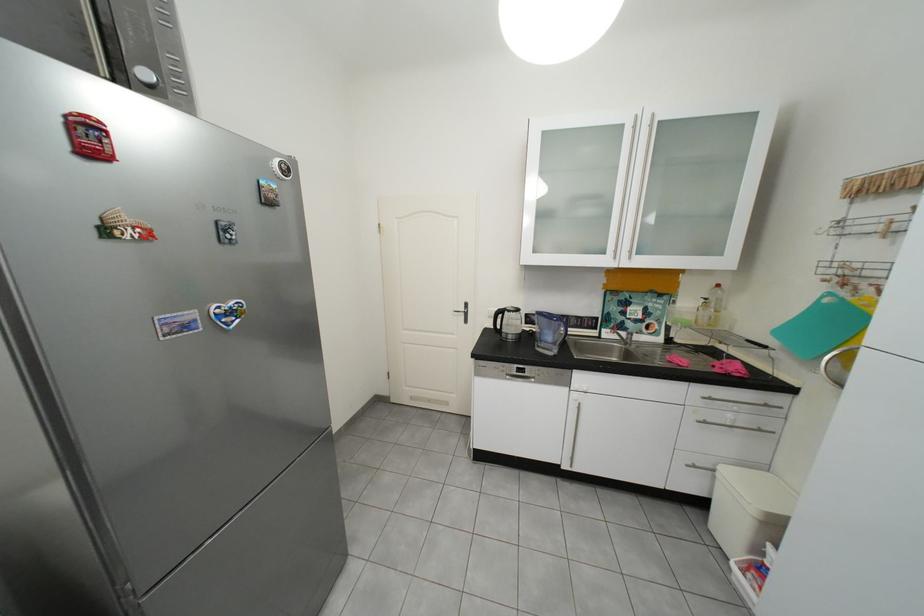
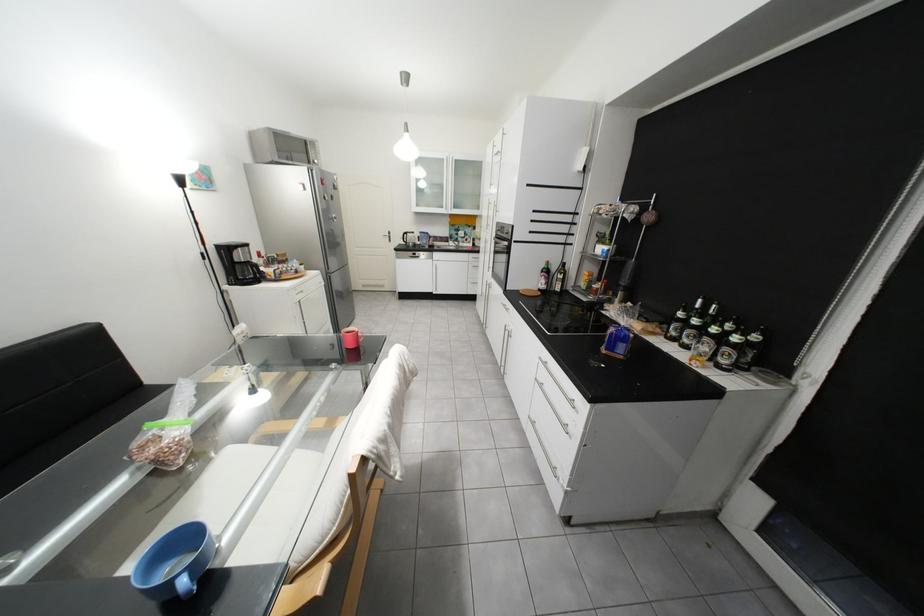
Question: I am providing you with two images of the same scene from different viewpoints. Which of the following objects are not visible in image2?

Choices:
 (A) pink coffee mug
 (B) coffee carafe handle
 (C) oven door handle
 (D) none of these

Answer: (D)